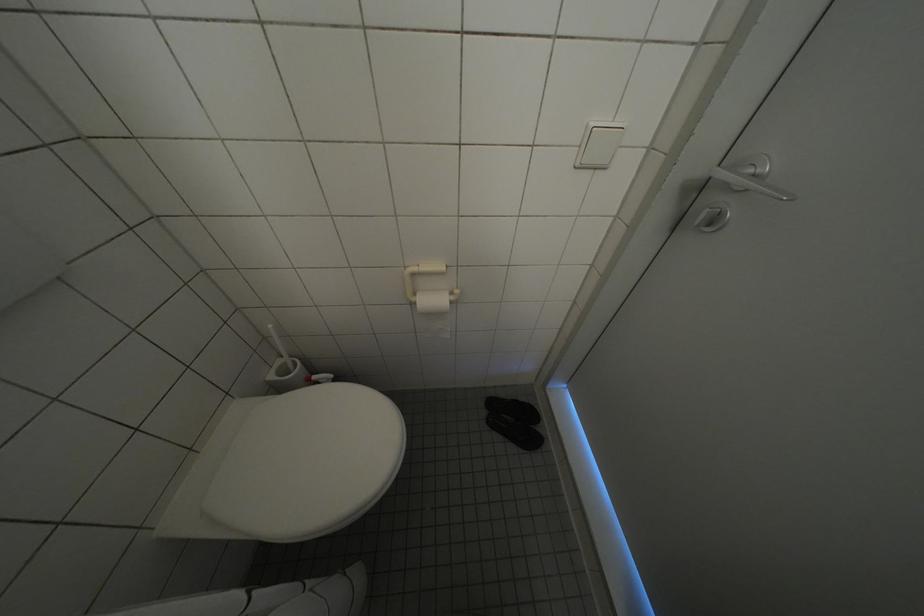
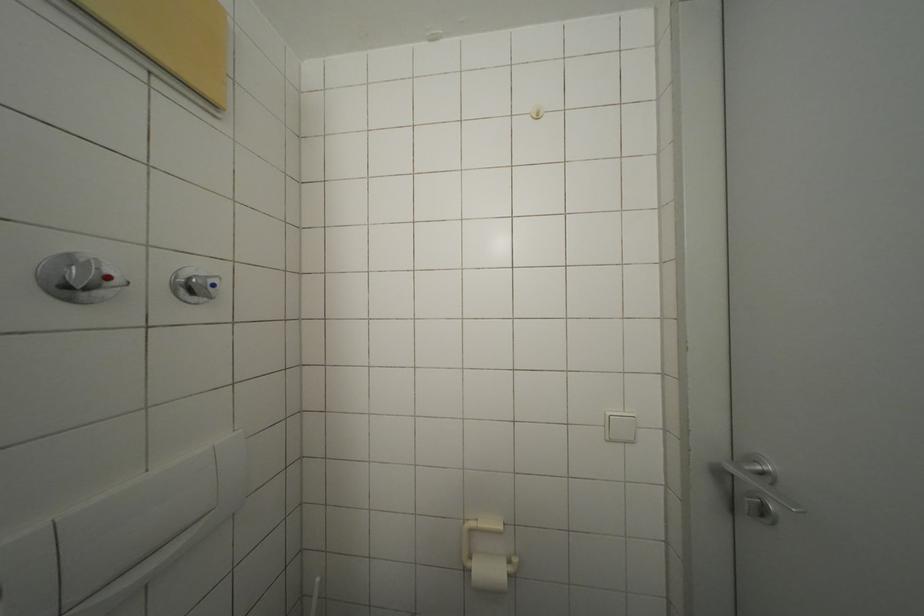
First-person continuous shooting, in which direction is the camera rotating?

The camera's rotation is toward left-up.